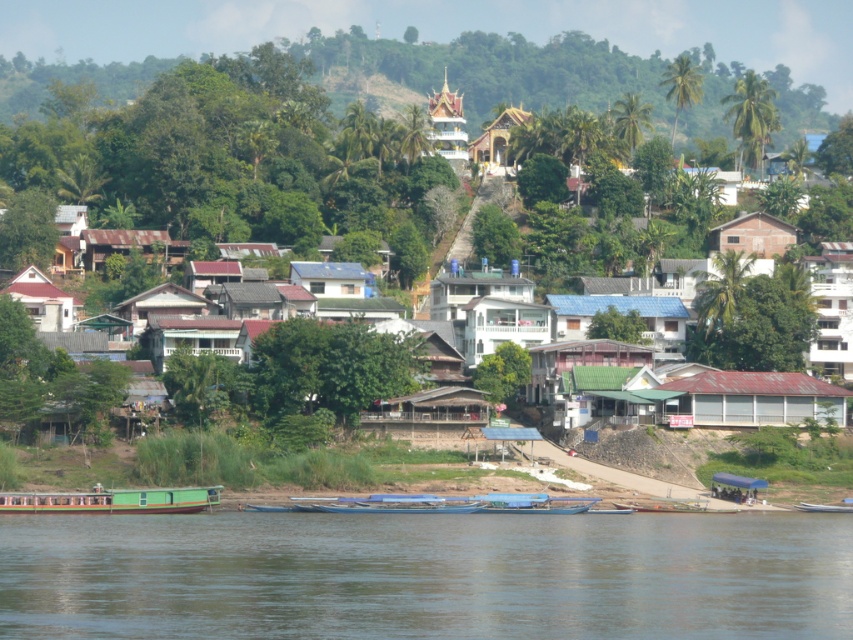
You are a tourist planning to take a photo of the white matte house at center and the white matte house at lower left. Which one should you focus on if you want to capture a larger structure in your photo?

The white matte house at center is bigger than the white matte house at lower left, so you should focus on the white matte house at center to capture a larger structure in your photo.

You are standing at the point marked by the coordinates point (624,314) in the riverside scene. What structure are you currently standing on?

You are standing on the blue corrugated metal hut at center, as the point (624,314) is located on it.